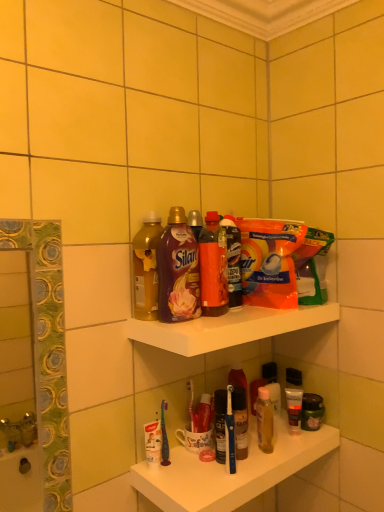
Question: Does white glossy shelf at upper center, marked as the 2th shelf in a bottom-to-top arrangement, have a smaller size compared to translucent orange bottle at center, the first bottle when ordered from right to left?

Choices:
 (A) yes
 (B) no

Answer: (B)

Question: From a real-world perspective, does white glossy shelf at upper center, marked as the 2th shelf in a bottom-to-top arrangement, sit lower than translucent orange bottle at center, which is counted as the 3th bottle, starting from the left?

Choices:
 (A) yes
 (B) no

Answer: (A)

Question: Is white glossy shelf at upper center, marked as the 2th shelf in a bottom-to-top arrangement, wider than translucent orange bottle at center, the first bottle when ordered from right to left?

Choices:
 (A) no
 (B) yes

Answer: (B)

Question: Would you say white glossy shelf at upper center, the first shelf from the top, is a long distance from translucent orange bottle at center, the first bottle when ordered from right to left?

Choices:
 (A) yes
 (B) no

Answer: (B)

Question: From the image's perspective, is white glossy shelf at upper center, marked as the 2th shelf in a bottom-to-top arrangement, on top of translucent orange bottle at center, the first bottle when ordered from right to left?

Choices:
 (A) no
 (B) yes

Answer: (A)

Question: Do you think white plastic toothbrushes at lower center, which is the second shelf in top-to-bottom order, is within matte gold bottle at upper center, which ranks as the 3th bottle in right-to-left order, or outside of it?

Choices:
 (A) inside
 (B) outside

Answer: (B)

Question: Based on their sizes in the image, would you say white plastic toothbrushes at lower center, which is the second shelf in top-to-bottom order, is bigger or smaller than matte gold bottle at upper center, positioned as the 1th bottle in left-to-right order?

Choices:
 (A) small
 (B) big

Answer: (B)

Question: Is point (274, 446) positioned closer to the camera than point (137, 274)?

Choices:
 (A) farther
 (B) closer

Answer: (A)

Question: In the image, is white plastic toothbrushes at lower center, which is the second shelf in top-to-bottom order, on the left side or the right side of matte gold bottle at upper center, which ranks as the 3th bottle in right-to-left order?

Choices:
 (A) left
 (B) right

Answer: (B)

Question: In terms of height, does matte plastic bottle at upper center, marked as the second bottle in a left-to-right arrangement, look taller or shorter compared to translucent orange bottle at center, the first bottle when ordered from right to left?

Choices:
 (A) tall
 (B) short

Answer: (A)

Question: Considering the relative positions of matte plastic bottle at upper center, marked as the second bottle in a left-to-right arrangement, and translucent orange bottle at center, which is counted as the 3th bottle, starting from the left, in the image provided, is matte plastic bottle at upper center, marked as the second bottle in a left-to-right arrangement, to the left or to the right of translucent orange bottle at center, which is counted as the 3th bottle, starting from the left,?

Choices:
 (A) right
 (B) left

Answer: (B)

Question: Considering the positions of matte plastic bottle at upper center, marked as the second bottle in a left-to-right arrangement, and translucent orange bottle at center, which is counted as the 3th bottle, starting from the left, in the image, is matte plastic bottle at upper center, marked as the second bottle in a left-to-right arrangement, wider or thinner than translucent orange bottle at center, which is counted as the 3th bottle, starting from the left,?

Choices:
 (A) thin
 (B) wide

Answer: (A)

Question: Is matte plastic bottle at upper center, which is the 2th bottle in right-to-left order, inside or outside of translucent orange bottle at center, the first bottle when ordered from right to left?

Choices:
 (A) inside
 (B) outside

Answer: (B)

Question: In terms of height, does translucent orange bottle at center, which is counted as the 3th bottle, starting from the left, look taller or shorter compared to white plastic toothbrushes at lower center, which is the second shelf in top-to-bottom order?

Choices:
 (A) tall
 (B) short

Answer: (A)

Question: Considering the positions of translucent orange bottle at center, which is counted as the 3th bottle, starting from the left, and white plastic toothbrushes at lower center, which is the second shelf in top-to-bottom order, in the image, is translucent orange bottle at center, which is counted as the 3th bottle, starting from the left, wider or thinner than white plastic toothbrushes at lower center, which is the second shelf in top-to-bottom order,?

Choices:
 (A) wide
 (B) thin

Answer: (B)